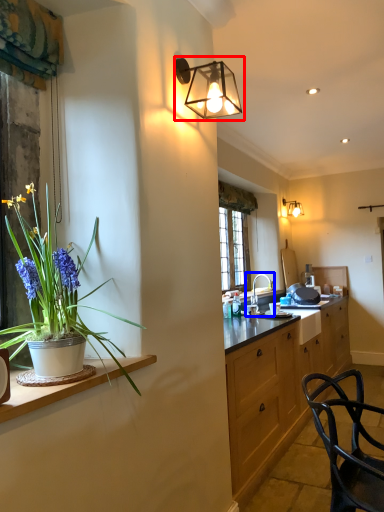
Question: Among these objects, which one is farthest to the camera, lamp (highlighted by a red box) or sink (highlighted by a blue box)?

Choices:
 (A) lamp
 (B) sink

Answer: (B)